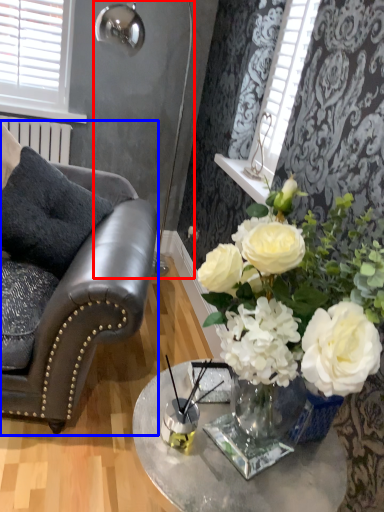
Question: Among these objects, which one is farthest to the camera, lamp (highlighted by a red box) or chair (highlighted by a blue box)?

Choices:
 (A) lamp
 (B) chair

Answer: (A)